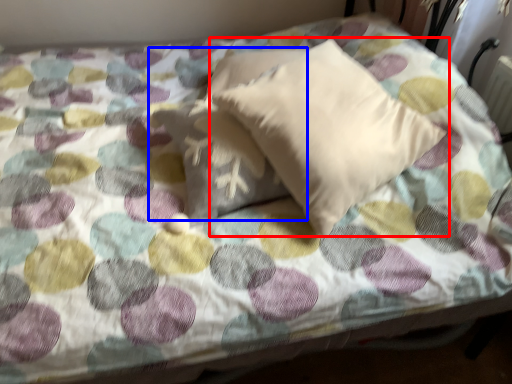
Question: Which object is further to the camera taking this photo, pillow (highlighted by a red box) or pillow (highlighted by a blue box)?

Choices:
 (A) pillow
 (B) pillow

Answer: (B)